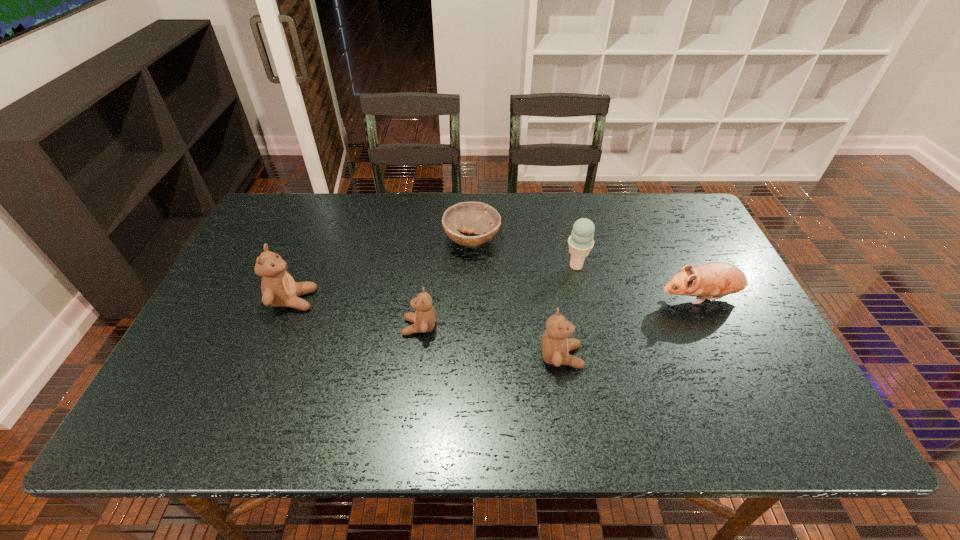
At what (x,y) coordinates should I click in order to perform the action: click on vacant point located on the front-facing side of the second object from left to right. Please return your answer as a coordinate pair (x, y). Image resolution: width=960 pixels, height=540 pixels. Looking at the image, I should click on (344, 327).

Where is `blank space located 0.280m on the front-facing side of the second object from left to right`? The height and width of the screenshot is (540, 960). blank space located 0.280m on the front-facing side of the second object from left to right is located at coordinates (292, 327).

Image resolution: width=960 pixels, height=540 pixels. What are the coordinates of `vacant area situated 0.370m on the front-facing side of the rightmost teddy bear` in the screenshot? It's located at (738, 357).

Find the location of a particular element. Image resolution: width=960 pixels, height=540 pixels. free location located 0.310m at the face of the hamster is located at coordinates (540, 298).

What are the coordinates of `free space located at the face of the hamster` in the screenshot? It's located at (609, 298).

Where is `vacant space located at the face of the hamster`? The image size is (960, 540). vacant space located at the face of the hamster is located at coordinates click(635, 298).

Find the location of a particular element. Image resolution: width=960 pixels, height=540 pixels. vacant space positioned 0.080m on the right of the fourth object from right to left is located at coordinates (526, 240).

At what (x,y) coordinates should I click in order to perform the action: click on vacant space located on the front of the ice cream. Please return your answer as a coordinate pair (x, y). Looking at the image, I should click on (596, 355).

You are a GUI agent. You are given a task and a screenshot of the screen. Output one action in this format:
    pyautogui.click(x=<x>, y=<y>)
    Task: Click on the object that is at the far edge
    
    Given the screenshot: What is the action you would take?
    pyautogui.click(x=479, y=218)

Find the location of a particular element. object positioned at the near edge is located at coordinates [555, 346].